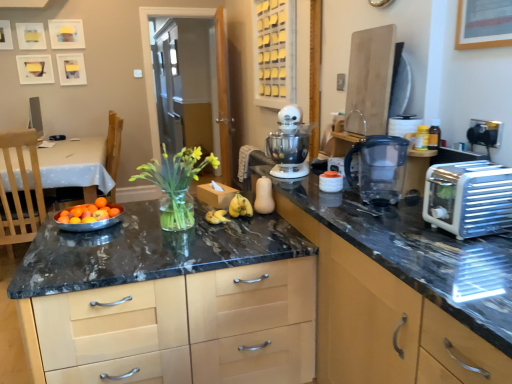
Locate an element on the screen. The height and width of the screenshot is (384, 512). free spot in front of white plastic toaster at right is located at coordinates pyautogui.click(x=476, y=253).